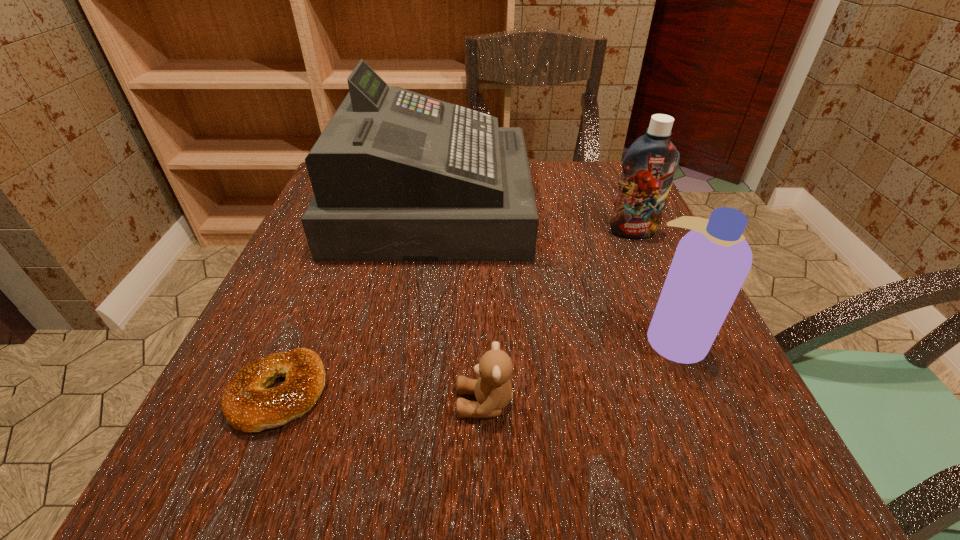
I want to click on vacant space located on the face of the teddy bear, so click(x=313, y=403).

The width and height of the screenshot is (960, 540). Find the location of `free space located on the back of the shortest object`. free space located on the back of the shortest object is located at coordinates (311, 313).

I want to click on object that is at the far edge, so click(x=397, y=176).

Where is `object situated at the near edge`? The height and width of the screenshot is (540, 960). object situated at the near edge is located at coordinates (247, 404).

Find the location of a particular element. The width and height of the screenshot is (960, 540). cash register present at the left edge is located at coordinates (397, 176).

This screenshot has width=960, height=540. I want to click on bagel situated at the left edge, so (x=247, y=404).

The image size is (960, 540). Find the location of `object present at the far left corner`. object present at the far left corner is located at coordinates (x=397, y=176).

This screenshot has width=960, height=540. In order to click on object at the near left corner in this screenshot , I will do `click(247, 404)`.

In the image, there is a desktop. Where is `vacant space at the far edge`? The image size is (960, 540). vacant space at the far edge is located at coordinates (532, 166).

The width and height of the screenshot is (960, 540). I want to click on free spot at the near edge of the desktop, so click(x=429, y=468).